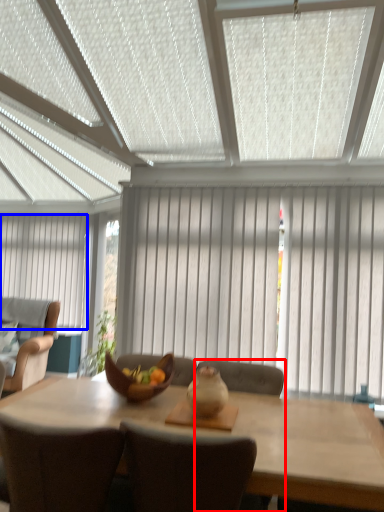
Question: Which object appears closest to the camera in this image, chair (highlighted by a red box) or curtain (highlighted by a blue box)?

Choices:
 (A) chair
 (B) curtain

Answer: (A)